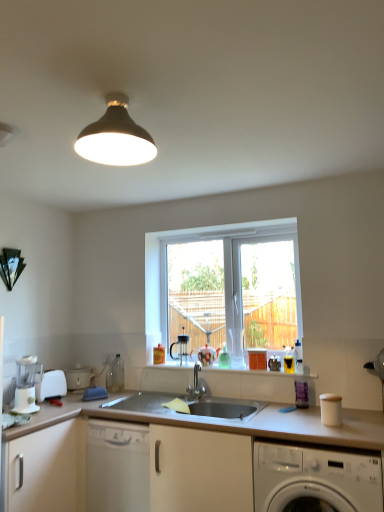
How much space does white plastic food processor at lower left, which is the second appliance in back-to-front order, occupy horizontally?

white plastic food processor at lower left, which is the second appliance in back-to-front order, is 19.09 centimeters in width.

Describe the element at coordinates (116, 137) in the screenshot. This screenshot has height=512, width=384. I see `matte black lampshade at upper center` at that location.

What do you see at coordinates (315, 479) in the screenshot? I see `white glossy washing machine at lower right` at bounding box center [315, 479].

Find the location of a particular element. This screenshot has width=384, height=512. translucent glass bottles at center is located at coordinates (259, 372).

What is the approximate height of white plastic blender at lower left, positioned as the second coffee machine in right-to-left order?

white plastic blender at lower left, positioned as the second coffee machine in right-to-left order, is 13.07 inches in height.

This screenshot has width=384, height=512. Find the location of `black plastic coffee machine at center, the second coffee machine positioned from the front`. black plastic coffee machine at center, the second coffee machine positioned from the front is located at coordinates (180, 348).

What do you see at coordinates (46, 469) in the screenshot?
I see `white matte cabinet at lower left` at bounding box center [46, 469].

Find the location of a particular element. The image size is (384, 512). white plastic food processor at lower left, which is the second appliance in back-to-front order is located at coordinates (51, 385).

Does white plastic food processor at lower left, acting as the 1th appliance starting from the front, have a greater width compared to translucent glass bottles at center?

No.

Considering the sizes of white plastic food processor at lower left, which is the second appliance in back-to-front order, and translucent glass bottles at center in the image, is white plastic food processor at lower left, which is the second appliance in back-to-front order, bigger or smaller than translucent glass bottles at center?

Considering their sizes, white plastic food processor at lower left, which is the second appliance in back-to-front order, takes up less space than translucent glass bottles at center.

Which is more to the left, white plastic food processor at lower left, which is the second appliance in back-to-front order, or translucent glass bottles at center?

From the viewer's perspective, white plastic food processor at lower left, which is the second appliance in back-to-front order, appears more on the left side.

Is white plastic food processor at lower left, acting as the 1th appliance starting from the front, located outside translucent glass bottles at center?

Yes, white plastic food processor at lower left, acting as the 1th appliance starting from the front, is not within translucent glass bottles at center.

From a real-world perspective, who is located higher, white glass window at center or white plastic toaster at lower left, which appears as the 1th appliance when viewed from the back?

→ white glass window at center.

Can you confirm if white glass window at center is wider than white plastic toaster at lower left, which appears as the 2th appliance when viewed from the front?

Incorrect, the width of white glass window at center does not surpass that of white plastic toaster at lower left, which appears as the 2th appliance when viewed from the front.

Is white glass window at center oriented towards white plastic toaster at lower left, which appears as the 2th appliance when viewed from the front?

No, white glass window at center is not turned towards white plastic toaster at lower left, which appears as the 2th appliance when viewed from the front.

Which is correct: white glass window at center is inside white plastic toaster at lower left, which appears as the 2th appliance when viewed from the front, or outside of it?

white glass window at center exists outside the volume of white plastic toaster at lower left, which appears as the 2th appliance when viewed from the front.

Image resolution: width=384 pixels, height=512 pixels. Find the location of `window behind the white plastic food processor at lower left, which is the second appliance in back-to-front order`. window behind the white plastic food processor at lower left, which is the second appliance in back-to-front order is located at coordinates (225, 286).

Consider the image. From the image's perspective, which one is positioned higher, white glass window at center or white plastic food processor at lower left, which is the second appliance in back-to-front order?

white glass window at center appears higher in the image.

Does white glass window at center have a larger size compared to white plastic food processor at lower left, which is the second appliance in back-to-front order?

Correct, white glass window at center is larger in size than white plastic food processor at lower left, which is the second appliance in back-to-front order.

From the picture: Is white glass window at center with white plastic food processor at lower left, which is the second appliance in back-to-front order?

white glass window at center and white plastic food processor at lower left, which is the second appliance in back-to-front order, are not in contact.

Is white matte cabinet at lower left facing towards white plastic food processor at lower left, which is the second appliance in back-to-front order?

No, white matte cabinet at lower left is not aimed at white plastic food processor at lower left, which is the second appliance in back-to-front order.

Is white matte cabinet at lower left bigger than white plastic food processor at lower left, which is the second appliance in back-to-front order?

Correct, white matte cabinet at lower left is larger in size than white plastic food processor at lower left, which is the second appliance in back-to-front order.

Which object is closer to the camera taking this photo, white matte cabinet at lower left or white plastic food processor at lower left, acting as the 1th appliance starting from the front?

Positioned in front is white matte cabinet at lower left.

Which of these two, white matte cabinet at lower left or white plastic food processor at lower left, acting as the 1th appliance starting from the front, stands shorter?

white plastic food processor at lower left, acting as the 1th appliance starting from the front, is shorter.

From the image's perspective, which one is positioned lower, white plastic food processor at lower left, acting as the 1th appliance starting from the front, or white glass window at center?

white plastic food processor at lower left, acting as the 1th appliance starting from the front, is shown below in the image.

Is white plastic food processor at lower left, which is the second appliance in back-to-front order, smaller than white glass window at center?

Indeed, white plastic food processor at lower left, which is the second appliance in back-to-front order, has a smaller size compared to white glass window at center.

Is white plastic food processor at lower left, which is the second appliance in back-to-front order, at the right side of white glass window at center?

No, white plastic food processor at lower left, which is the second appliance in back-to-front order, is not to the right of white glass window at center.

Would you say white plastic food processor at lower left, acting as the 1th appliance starting from the front, contains white glass window at center?

That's incorrect, white glass window at center is not inside white plastic food processor at lower left, acting as the 1th appliance starting from the front.

Does white plastic food processor at lower left, acting as the 1th appliance starting from the front, have a greater height compared to white matte cabinet at lower left?

In fact, white plastic food processor at lower left, acting as the 1th appliance starting from the front, may be shorter than white matte cabinet at lower left.

Would you consider white plastic food processor at lower left, acting as the 1th appliance starting from the front, to be distant from white matte cabinet at lower left?

white plastic food processor at lower left, acting as the 1th appliance starting from the front, is near white matte cabinet at lower left, not far away.

Which of these two, white plastic food processor at lower left, acting as the 1th appliance starting from the front, or white matte cabinet at lower left, is smaller?

white plastic food processor at lower left, acting as the 1th appliance starting from the front.

Based on the photo, is white plastic food processor at lower left, acting as the 1th appliance starting from the front, to the left of white matte cabinet at lower left from the viewer's perspective?

No.

Is white glass window at center located within matte black lampshade at upper center?

No, white glass window at center is not inside matte black lampshade at upper center.

Looking at the image, does matte black lampshade at upper center seem bigger or smaller compared to white glass window at center?

Clearly, matte black lampshade at upper center is smaller in size than white glass window at center.

Looking at this image, considering the sizes of matte black lampshade at upper center and white glass window at center in the image, is matte black lampshade at upper center wider or thinner than white glass window at center?

Result: In the image, matte black lampshade at upper center appears to be wider than white glass window at center.

Where is `window sill above the white plastic food processor at lower left, acting as the 1th appliance starting from the front (from a real-world perspective)`? window sill above the white plastic food processor at lower left, acting as the 1th appliance starting from the front (from a real-world perspective) is located at coordinates (259, 372).

The image size is (384, 512). I want to click on appliance behind the white glass window at center, so click(x=78, y=377).

Based on their spatial positions, is white plastic blender at lower left, the 2th coffee machine positioned from the back, or white matte cabinet at lower left closer to white plastic toaster at lower left, which appears as the 2th appliance when viewed from the front?

The object closer to white plastic toaster at lower left, which appears as the 2th appliance when viewed from the front, is white plastic blender at lower left, the 2th coffee machine positioned from the back.

Considering their positions, is white matte countertop at center positioned further to white matte cabinet at lower left than white plastic food processor at lower left, acting as the 1th appliance starting from the front?

white plastic food processor at lower left, acting as the 1th appliance starting from the front.

Based on their spatial positions, is white matte countertop at center or white plastic blender at lower left, arranged as the first coffee machine when viewed from the left, further from black plastic coffee machine at center, the 1th coffee machine positioned from the right?

white plastic blender at lower left, arranged as the first coffee machine when viewed from the left, is further to black plastic coffee machine at center, the 1th coffee machine positioned from the right.

From the picture: Which object lies further to the anchor point white glossy washing machine at lower right, white glass window at center or white matte cabinet at lower left?

Based on the image, white matte cabinet at lower left appears to be further to white glossy washing machine at lower right.

Which object lies further to the anchor point white plastic toaster at lower left, which appears as the 2th appliance when viewed from the front, white glass window at center or translucent glass bottles at center?

The object further to white plastic toaster at lower left, which appears as the 2th appliance when viewed from the front, is white glass window at center.

Looking at the image, which one is located further to white plastic blender at lower left, arranged as the first coffee machine when viewed from the left, white plastic food processor at lower left, acting as the 1th appliance starting from the front, or black plastic coffee machine at center, the second coffee machine positioned from the front?

black plastic coffee machine at center, the second coffee machine positioned from the front, lies further to white plastic blender at lower left, arranged as the first coffee machine when viewed from the left, than the other object.

When comparing their distances from white matte countertop at center, does matte black lampshade at upper center or translucent glass bottles at center seem closer?

translucent glass bottles at center is closer to white matte countertop at center.

Which object lies further to the anchor point white plastic food processor at lower left, acting as the 1th appliance starting from the front, translucent glass bottles at center or white plastic toaster at lower left, which appears as the 2th appliance when viewed from the front?

Among the two, translucent glass bottles at center is located further to white plastic food processor at lower left, acting as the 1th appliance starting from the front.

Where is `cabinetry between matte black lampshade at upper center and white matte countertop at center in the up-down direction`? This screenshot has height=512, width=384. cabinetry between matte black lampshade at upper center and white matte countertop at center in the up-down direction is located at coordinates (46, 469).

Where is `window sill situated between white plastic toaster at lower left, which appears as the 1th appliance when viewed from the back, and white glossy washing machine at lower right from left to right`? window sill situated between white plastic toaster at lower left, which appears as the 1th appliance when viewed from the back, and white glossy washing machine at lower right from left to right is located at coordinates (259, 372).

Identify the location of window between matte black lampshade at upper center and white matte cabinet at lower left vertically. The width and height of the screenshot is (384, 512). (225, 286).

Locate an element on the screen. This screenshot has width=384, height=512. coffee machine between white matte cabinet at lower left and black plastic coffee machine at center, the 1th coffee machine positioned from the right, from left to right is located at coordinates (25, 386).